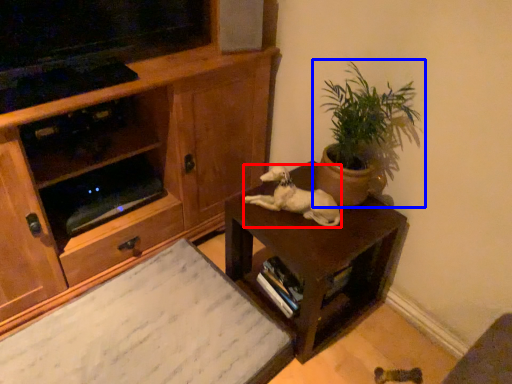
Question: Which object appears farthest to the camera in this image, animal (highlighted by a red box) or houseplant (highlighted by a blue box)?

Choices:
 (A) animal
 (B) houseplant

Answer: (A)